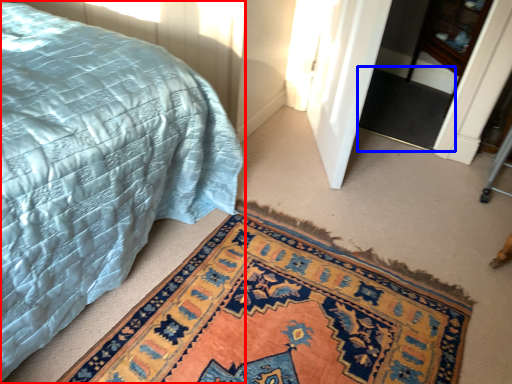
Question: Which point is further to the camera, bed (highlighted by a red box) or doormat (highlighted by a blue box)?

Choices:
 (A) bed
 (B) doormat

Answer: (B)